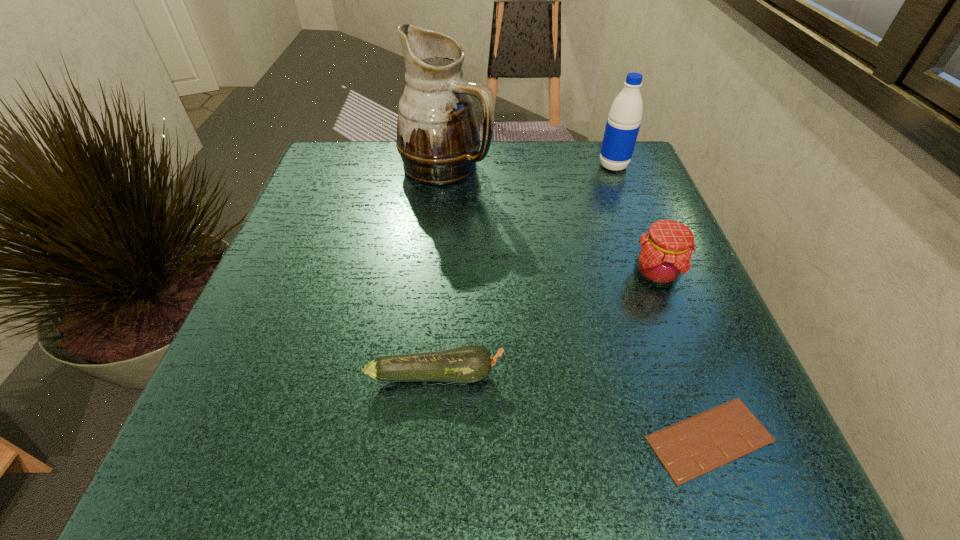
Where is `pitcher`? pitcher is located at coordinates (437, 133).

Locate an element on the screen. The height and width of the screenshot is (540, 960). the second tallest object is located at coordinates (622, 127).

Locate an element on the screen. the third nearest object is located at coordinates (664, 254).

Image resolution: width=960 pixels, height=540 pixels. Find the location of `jam`. jam is located at coordinates click(x=664, y=254).

Locate an element on the screen. This screenshot has height=540, width=960. zucchini is located at coordinates (467, 364).

Identify the location of the second shortest object. This screenshot has width=960, height=540. (467, 364).

This screenshot has width=960, height=540. In order to click on the shortest object in this screenshot , I will do `click(690, 448)`.

Find the location of `the nearest object`. the nearest object is located at coordinates (690, 448).

Identify the location of vacant space located from the spout of the tallest object. (598, 166).

Find the location of a particular element. vacant region located 0.080m on the left of the water bottle is located at coordinates [564, 166].